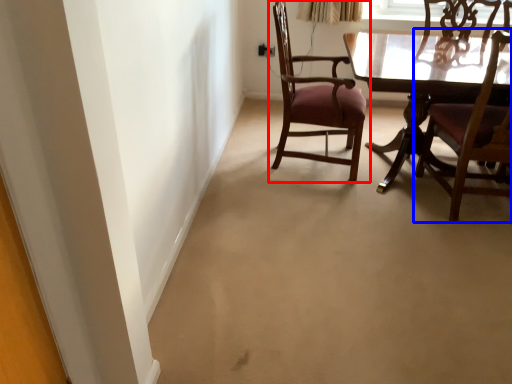
Question: Which of the following is the closest to the observer, chair (highlighted by a red box) or chair (highlighted by a blue box)?

Choices:
 (A) chair
 (B) chair

Answer: (B)